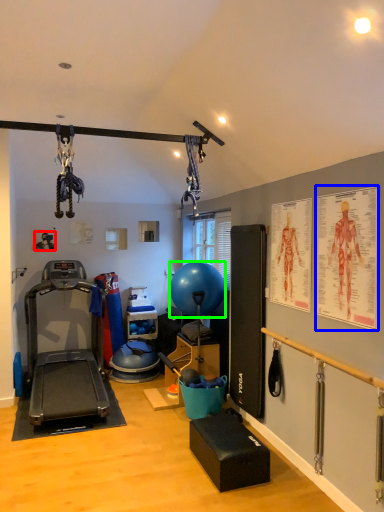
Question: Considering the real-world distances, which object is closest to person (highlighted by a red box)? poster page (highlighted by a blue box) or balloon (highlighted by a green box).

Choices:
 (A) poster page
 (B) balloon

Answer: (B)